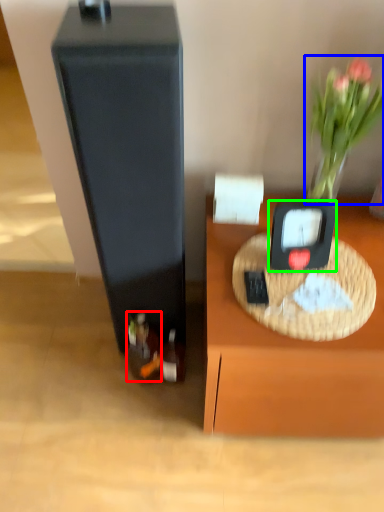
Question: Considering the real-world distances, which object is closest to wine bottle (highlighted by a red box)? plant (highlighted by a blue box) or weight scale (highlighted by a green box).

Choices:
 (A) plant
 (B) weight scale

Answer: (B)